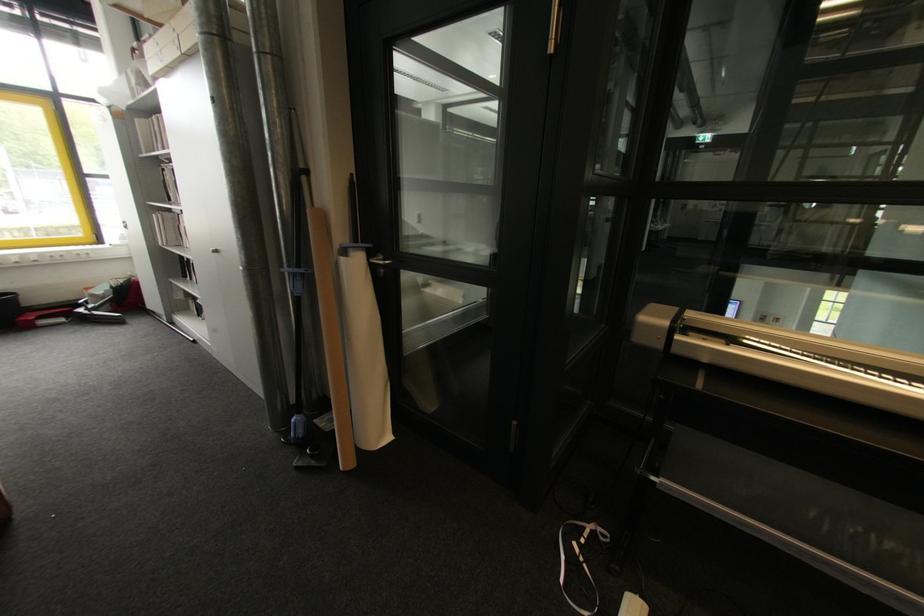
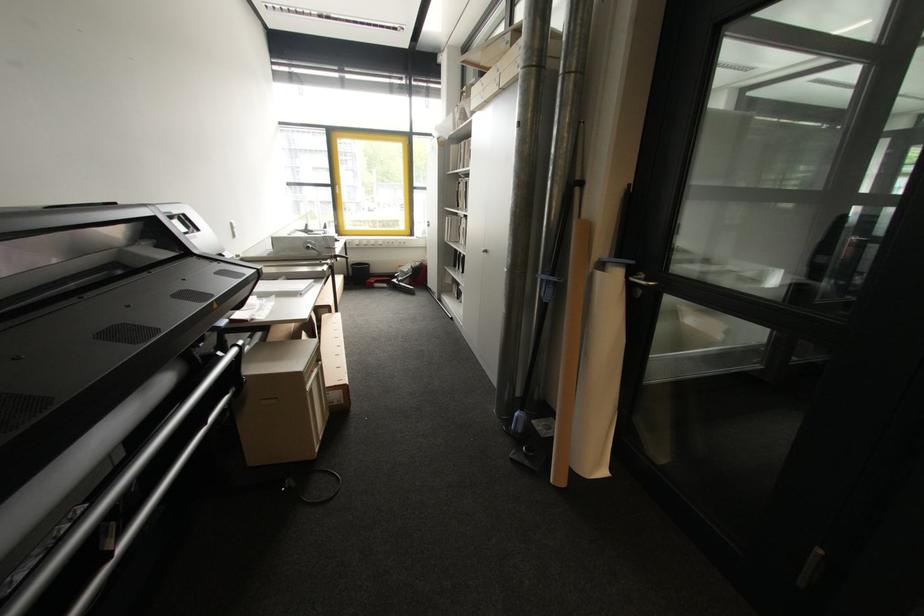
Question: The images are taken continuously from a first-person perspective. In which direction is your viewpoint rotating?

Choices:
 (A) Left
 (B) Right
 (C) Up
 (D) Down

Answer: (A)